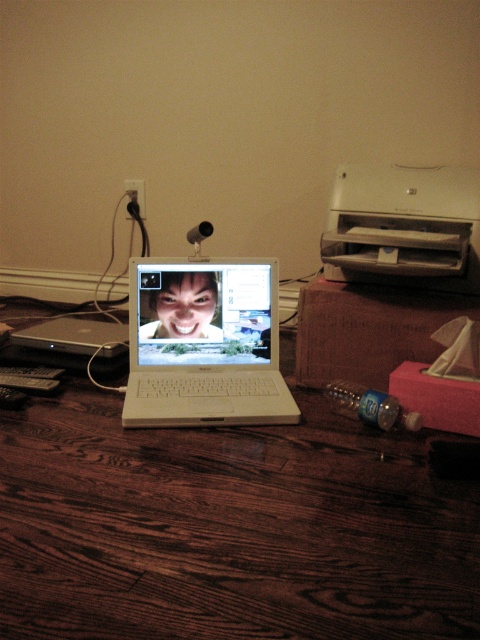
You are organizing a virtual meeting and need to place a 12 inch by 12 inch decorative plate between the wooden table at center and the shiny white laptop at center. Based on their sizes, will the plate fit on the available space between them?

The wooden table at center is larger in size than the shiny white laptop at center, so there should be enough space to place the 12 inch by 12 inch decorative plate between them.

You are setting up a new workspace and need to place both the white plastic printer at upper right and the shiny white laptop at center on a desk. Based on their sizes, which one should you place first if you want to ensure there is enough space for both?

The white plastic printer at upper right might be wider than the shiny white laptop at center, so you should place the printer first to ensure there is enough space for both.

You are standing in the room and want to reach both points marked in the image. Which point, point 1 at coordinates (x=108, y=406) or point 2 at coordinates (x=170, y=284), will you reach first if you move directly towards them?

Point 1 at coordinates (x=108, y=406) is closer to the viewer than point 2 at coordinates (x=170, y=284), so you will reach point 1 first.